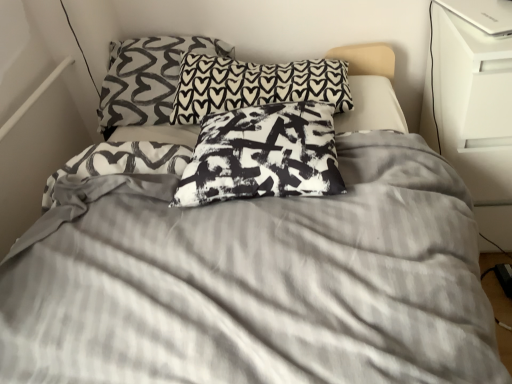
Question: Is white glossy dresser at right a part of black printed pillow at upper center, which appears as the first pillow when viewed from the back?

Choices:
 (A) yes
 (B) no

Answer: (B)

Question: Can you confirm if black printed pillow at upper center, which appears as the first pillow when viewed from the back, is smaller than white glossy dresser at right?

Choices:
 (A) no
 (B) yes

Answer: (B)

Question: From a real-world perspective, does black printed pillow at upper center, which appears as the first pillow when viewed from the back, stand above white glossy dresser at right?

Choices:
 (A) no
 (B) yes

Answer: (B)

Question: Can you confirm if black printed pillow at upper center, which appears as the 3th pillow when viewed from the front, is wider than white glossy dresser at right?

Choices:
 (A) yes
 (B) no

Answer: (B)

Question: Are black printed pillow at upper center, which appears as the first pillow when viewed from the back, and white glossy dresser at right far apart?

Choices:
 (A) yes
 (B) no

Answer: (B)

Question: Considering the positions of point (174, 196) and point (425, 114), is point (174, 196) closer or farther from the camera than point (425, 114)?

Choices:
 (A) closer
 (B) farther

Answer: (A)

Question: Is black printed pillow at center, the first pillow in the front-to-back sequence, bigger or smaller than white glossy dresser at right?

Choices:
 (A) small
 (B) big

Answer: (A)

Question: In terms of height, does black printed pillow at center, the first pillow in the front-to-back sequence, look taller or shorter compared to white glossy dresser at right?

Choices:
 (A) tall
 (B) short

Answer: (B)

Question: Is black printed pillow at center, the first pillow in the front-to-back sequence, in front of or behind white glossy dresser at right in the image?

Choices:
 (A) behind
 (B) front

Answer: (B)

Question: In terms of width, does black printed pillow at upper center, acting as the 2th pillow starting from the back, look wider or thinner when compared to white glossy dresser at right?

Choices:
 (A) wide
 (B) thin

Answer: (A)

Question: Choose the correct answer: Is black printed pillow at upper center, acting as the second pillow starting from the front, inside white glossy dresser at right or outside it?

Choices:
 (A) inside
 (B) outside

Answer: (B)

Question: In terms of size, does black printed pillow at upper center, acting as the second pillow starting from the front, appear bigger or smaller than white glossy dresser at right?

Choices:
 (A) big
 (B) small

Answer: (B)

Question: Is point (218, 64) closer or farther from the camera than point (508, 218)?

Choices:
 (A) farther
 (B) closer

Answer: (A)

Question: Would you say black printed pillow at upper center, acting as the 2th pillow starting from the back, is to the left or to the right of black printed pillow at upper center, which appears as the 3th pillow when viewed from the front, in the picture?

Choices:
 (A) right
 (B) left

Answer: (A)

Question: Is black printed pillow at upper center, acting as the 2th pillow starting from the back, inside the boundaries of black printed pillow at upper center, which appears as the 3th pillow when viewed from the front, or outside?

Choices:
 (A) inside
 (B) outside

Answer: (B)